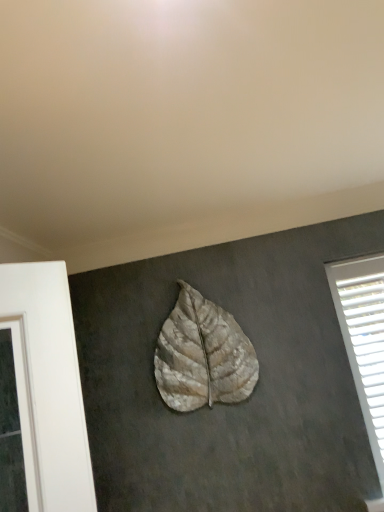
Question: Does textured beige leaf at center appear on the left side of white plastic blinds at right?

Choices:
 (A) yes
 (B) no

Answer: (A)

Question: Considering the relative sizes of textured beige leaf at center and white plastic blinds at right in the image provided, is textured beige leaf at center shorter than white plastic blinds at right?

Choices:
 (A) yes
 (B) no

Answer: (A)

Question: Can you confirm if textured beige leaf at center is taller than white plastic blinds at right?

Choices:
 (A) no
 (B) yes

Answer: (A)

Question: Is textured beige leaf at center positioned with its back to white plastic blinds at right?

Choices:
 (A) no
 (B) yes

Answer: (A)

Question: Could you tell me if textured beige leaf at center is turned towards white plastic blinds at right?

Choices:
 (A) yes
 (B) no

Answer: (B)

Question: From the image's perspective, is textured beige leaf at center on top of white plastic blinds at right?

Choices:
 (A) yes
 (B) no

Answer: (A)

Question: Considering the relative positions of white plastic blinds at right and textured beige leaf at center in the image provided, is white plastic blinds at right to the right of textured beige leaf at center from the viewer's perspective?

Choices:
 (A) yes
 (B) no

Answer: (A)

Question: Is textured beige leaf at center surrounded by white plastic blinds at right?

Choices:
 (A) no
 (B) yes

Answer: (A)

Question: From the image's perspective, is white plastic blinds at right beneath textured beige leaf at center?

Choices:
 (A) yes
 (B) no

Answer: (A)

Question: Is white plastic blinds at right beside textured beige leaf at center?

Choices:
 (A) yes
 (B) no

Answer: (B)

Question: Can you confirm if white plastic blinds at right is taller than textured beige leaf at center?

Choices:
 (A) yes
 (B) no

Answer: (A)

Question: Is white plastic blinds at right outside textured beige leaf at center?

Choices:
 (A) yes
 (B) no

Answer: (A)

Question: Based on their positions, is textured beige leaf at center located to the left or right of white plastic blinds at right?

Choices:
 (A) right
 (B) left

Answer: (B)